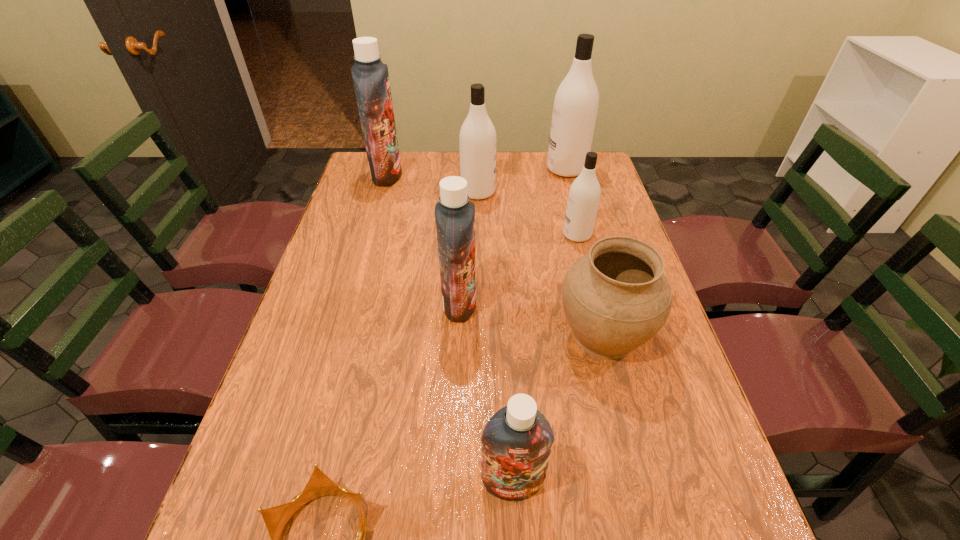
Locate an element on the screen. This screenshot has height=540, width=960. the smallest blue shampoo is located at coordinates (517, 440).

Find the location of `urn`. urn is located at coordinates (616, 298).

Find the location of a particular element. Image resolution: width=960 pixels, height=540 pixels. free space located 0.130m on the front-facing side of the farthest white shampoo is located at coordinates (511, 169).

Identify the location of vacant space positioned 0.380m on the front-facing side of the farthest white shampoo. 443,169.

Where is `free space located 0.200m on the front-facing side of the farthest white shampoo`? This screenshot has width=960, height=540. free space located 0.200m on the front-facing side of the farthest white shampoo is located at coordinates (492, 169).

Where is `vacant space located 0.140m on the front label of the leftmost blue shampoo`? vacant space located 0.140m on the front label of the leftmost blue shampoo is located at coordinates (441, 175).

Image resolution: width=960 pixels, height=540 pixels. I want to click on vacant region located on the front label of the second blue shampoo from left to right, so click(588, 303).

Identify the location of free space located on the front-facing side of the second biggest white shampoo. This screenshot has width=960, height=540. tap(542, 192).

This screenshot has width=960, height=540. I want to click on free region located 0.240m on the front-facing side of the smallest white shampoo, so click(x=484, y=235).

This screenshot has width=960, height=540. I want to click on vacant space situated on the front-facing side of the smallest white shampoo, so click(546, 235).